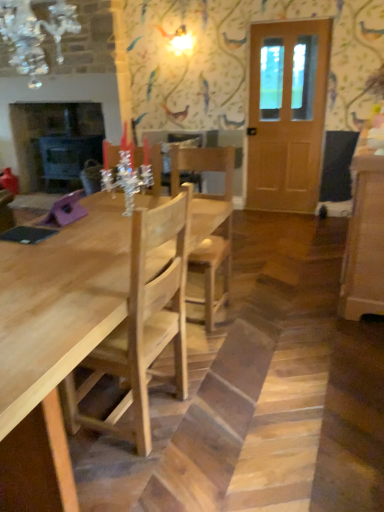
Question: Is light wood table at center positioned far away from matte black fireplace at left?

Choices:
 (A) no
 (B) yes

Answer: (B)

Question: Considering the relative sizes of light wood table at center and matte black fireplace at left in the image provided, is light wood table at center smaller than matte black fireplace at left?

Choices:
 (A) yes
 (B) no

Answer: (A)

Question: Is light wood table at center thinner than matte black fireplace at left?

Choices:
 (A) no
 (B) yes

Answer: (A)

Question: Considering the relative sizes of light wood table at center and matte black fireplace at left in the image provided, is light wood table at center wider than matte black fireplace at left?

Choices:
 (A) no
 (B) yes

Answer: (B)

Question: Is light wood table at center at the left side of matte black fireplace at left?

Choices:
 (A) yes
 (B) no

Answer: (B)

Question: Does light wood table at center touch matte black fireplace at left?

Choices:
 (A) yes
 (B) no

Answer: (B)

Question: Does matte black fireplace at left appear on the left side of wooden door at right?

Choices:
 (A) yes
 (B) no

Answer: (A)

Question: Does matte black fireplace at left touch wooden door at right?

Choices:
 (A) yes
 (B) no

Answer: (B)

Question: Can wooden door at right be found inside matte black fireplace at left?

Choices:
 (A) yes
 (B) no

Answer: (B)

Question: From a real-world perspective, is matte black fireplace at left on top of wooden door at right?

Choices:
 (A) no
 (B) yes

Answer: (A)

Question: From a real-world perspective, is matte black fireplace at left positioned under wooden door at right based on gravity?

Choices:
 (A) yes
 (B) no

Answer: (A)

Question: Could you tell me if matte black fireplace at left is facing wooden door at right?

Choices:
 (A) yes
 (B) no

Answer: (B)

Question: From a real-world perspective, is light wood table at center positioned under wooden door at right based on gravity?

Choices:
 (A) no
 (B) yes

Answer: (B)